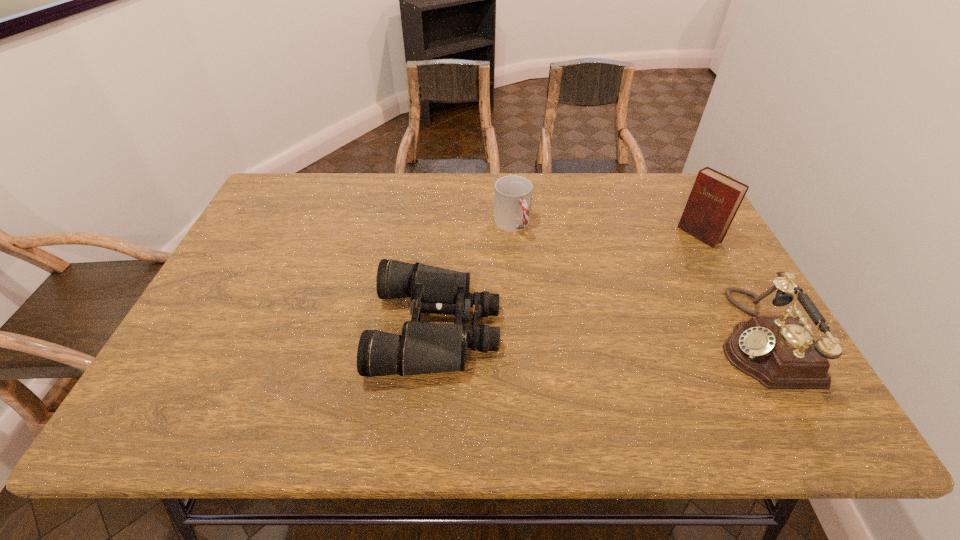
Where is `vacant space at the far edge of the desktop`? The height and width of the screenshot is (540, 960). vacant space at the far edge of the desktop is located at coordinates (427, 191).

You are a GUI agent. You are given a task and a screenshot of the screen. Output one action in this format:
    pyautogui.click(x=<x>, y=<y>)
    Task: Click on the vacant position at the near edge of the desktop
    This screenshot has width=960, height=540.
    Given the screenshot: What is the action you would take?
    pyautogui.click(x=718, y=367)

The height and width of the screenshot is (540, 960). In order to click on free space at the left edge of the desktop in this screenshot , I will do `click(240, 327)`.

This screenshot has height=540, width=960. I want to click on free spot at the right edge of the desktop, so click(x=696, y=307).

Where is `vacant space at the far left corner of the desktop`? The image size is (960, 540). vacant space at the far left corner of the desktop is located at coordinates (300, 181).

Image resolution: width=960 pixels, height=540 pixels. Find the location of `free spot at the near left corner of the desktop`. free spot at the near left corner of the desktop is located at coordinates (226, 383).

Locate an element on the screen. This screenshot has width=960, height=540. free region at the far right corner of the desktop is located at coordinates (671, 186).

Image resolution: width=960 pixels, height=540 pixels. In order to click on unoccupied area between the diary and the cup in this screenshot , I will do `click(606, 230)`.

I want to click on vacant area between the cup and the diary, so click(606, 230).

At what (x,y) coordinates should I click in order to perform the action: click on vacant space that is in between the binoculars and the diary. Please return your answer as a coordinate pair (x, y). Looking at the image, I should click on 568,281.